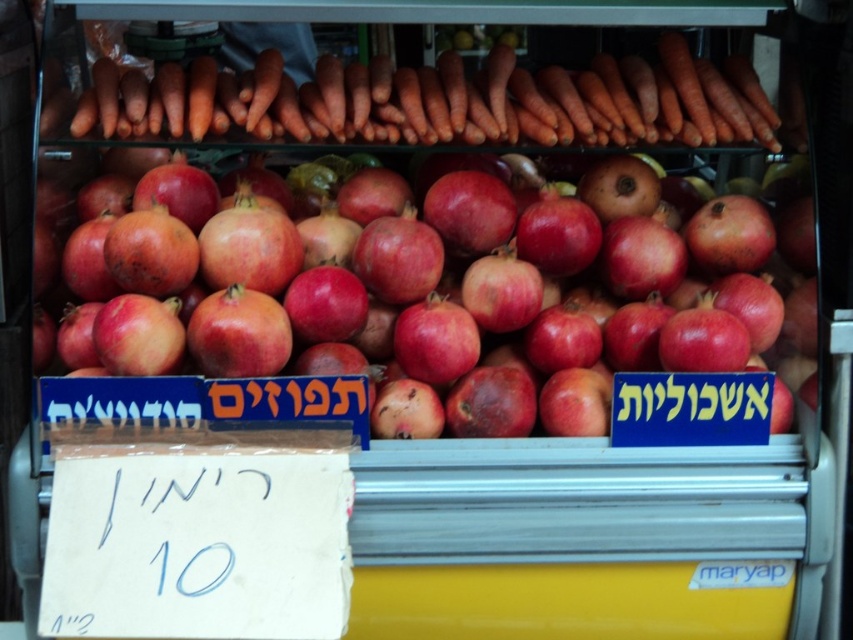
Does shiny red pomegranate at center appear on the right side of orange smooth carrots at upper center?

Yes, shiny red pomegranate at center is to the right of orange smooth carrots at upper center.

Can you confirm if shiny red pomegranate at center is bigger than orange smooth carrots at upper center?

Yes, shiny red pomegranate at center is bigger than orange smooth carrots at upper center.

Who is more distant from viewer, (635, 321) or (456, 68)?

Point (456, 68)

Where is `shiny red pomegranate at center`? shiny red pomegranate at center is located at coordinates (450, 300).